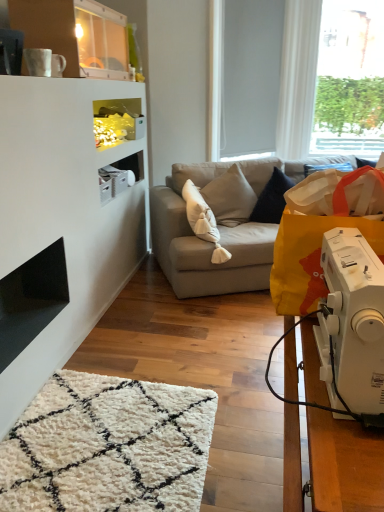
Question: Is light gray fabric couch at center positioned with its back to transparent glass window at upper right?

Choices:
 (A) no
 (B) yes

Answer: (A)

Question: Is light gray fabric couch at center behind transparent glass window at upper right?

Choices:
 (A) no
 (B) yes

Answer: (A)

Question: From a real-world perspective, is light gray fabric couch at center physically below transparent glass window at upper right?

Choices:
 (A) yes
 (B) no

Answer: (A)

Question: Is light gray fabric couch at center positioned before transparent glass window at upper right?

Choices:
 (A) yes
 (B) no

Answer: (A)

Question: Does light gray fabric couch at center appear on the right side of transparent glass window at upper right?

Choices:
 (A) yes
 (B) no

Answer: (B)

Question: Does light gray fabric couch at center have a greater height compared to transparent glass window at upper right?

Choices:
 (A) no
 (B) yes

Answer: (A)

Question: From a real-world perspective, does beige fabric pillow at center sit lower than white matte window screen at upper right?

Choices:
 (A) no
 (B) yes

Answer: (B)

Question: Does beige fabric pillow at center have a larger size compared to white matte window screen at upper right?

Choices:
 (A) yes
 (B) no

Answer: (A)

Question: Would you say beige fabric pillow at center is a long distance from white matte window screen at upper right?

Choices:
 (A) yes
 (B) no

Answer: (A)

Question: Can you confirm if beige fabric pillow at center is taller than white matte window screen at upper right?

Choices:
 (A) no
 (B) yes

Answer: (A)

Question: Is beige fabric pillow at center thinner than white matte window screen at upper right?

Choices:
 (A) no
 (B) yes

Answer: (A)

Question: Is beige fabric pillow at center behind white matte window screen at upper right?

Choices:
 (A) no
 (B) yes

Answer: (A)

Question: Is white plastic sewing machine at lower right outside beige fabric pillow at center?

Choices:
 (A) yes
 (B) no

Answer: (A)